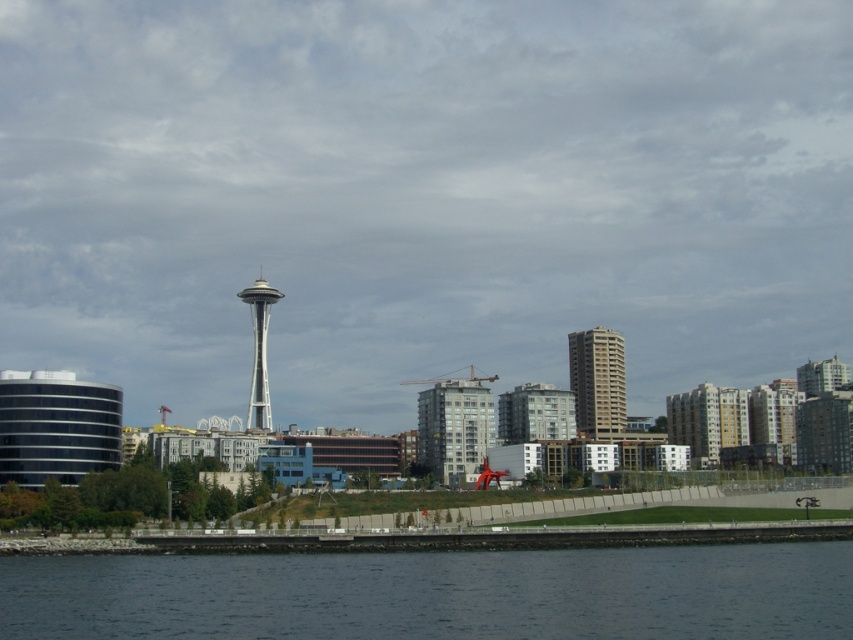
Question: Among these points, which one is farthest from the camera?

Choices:
 (A) (564, 632)
 (B) (567, 346)
 (C) (270, 417)

Answer: (B)

Question: Among these objects, which one is nearest to the camera?

Choices:
 (A) dark blue water at lower center
 (B) silver metallic space needle at center

Answer: (A)

Question: Is dark blue water at lower center to the right of silver metallic space needle at center from the viewer's perspective?

Choices:
 (A) no
 (B) yes

Answer: (B)

Question: Can you confirm if dark blue water at lower center is thinner than beige concrete building at center?

Choices:
 (A) no
 (B) yes

Answer: (A)

Question: Is dark blue water at lower center above beige concrete building at center?

Choices:
 (A) yes
 (B) no

Answer: (B)

Question: Which point is closer to the camera taking this photo?

Choices:
 (A) (175, 616)
 (B) (260, 397)

Answer: (A)